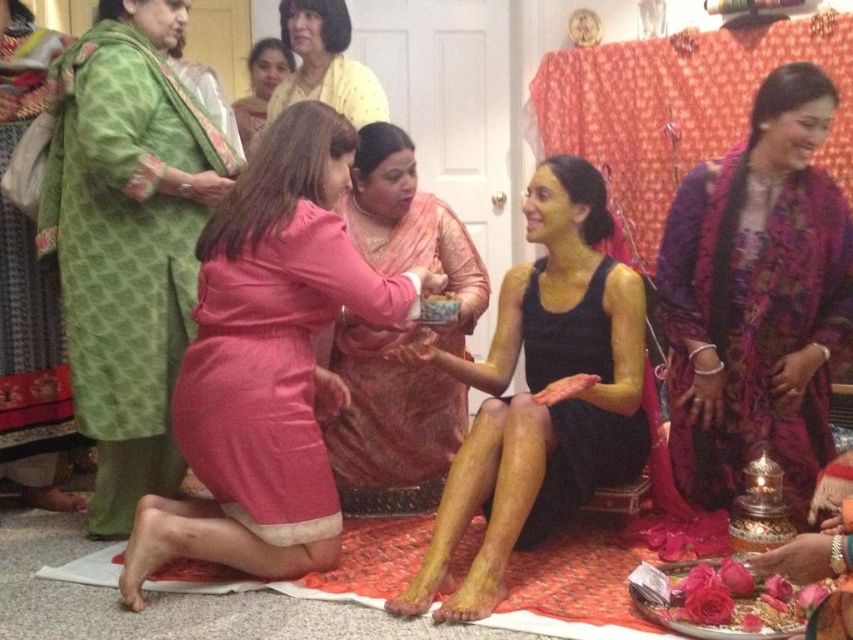
Question: Is the position of black matte dress at center less distant than that of matte yellow skin at center?

Choices:
 (A) no
 (B) yes

Answer: (B)

Question: Based on their relative distances, which object is farther from the matte pink dress at center?

Choices:
 (A) green textured robe at upper left
 (B) yellow clay body at center

Answer: (B)

Question: Among these objects, which one is nearest to the camera?

Choices:
 (A) pink satin dress at center
 (B) pink silk saree at center

Answer: (A)

Question: Is yellow clay body at center behind matte yellow skin at center?

Choices:
 (A) yes
 (B) no

Answer: (B)

Question: Where is matte yellow skin at center located in relation to matte pink dress at center in the image?

Choices:
 (A) below
 (B) above

Answer: (A)

Question: Among these points, which one is nearest to the camera?

Choices:
 (A) (155, 273)
 (B) (579, 312)
 (C) (282, 70)

Answer: (A)